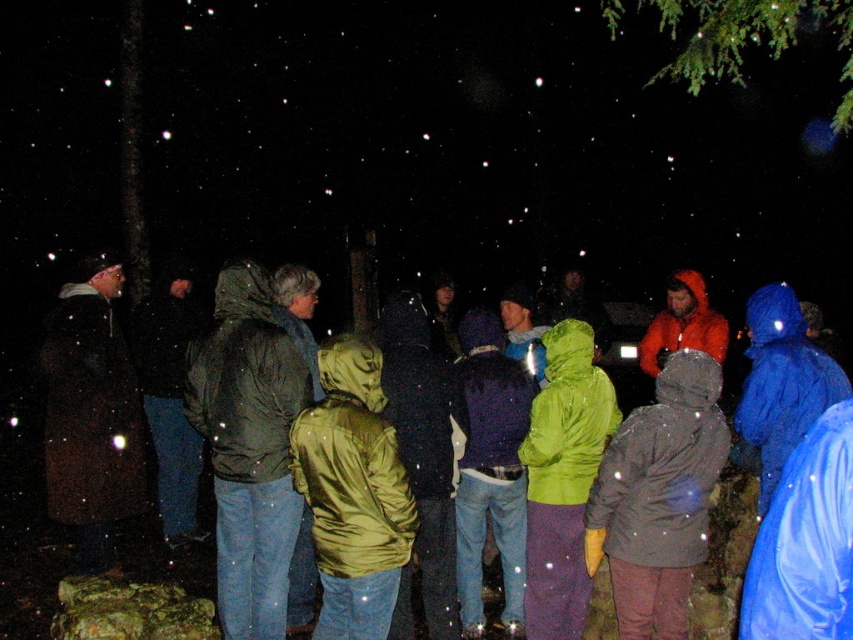
Does point (73, 326) lie in front of point (721, 54)?

That is False.

Is dark brown jacket at left thinner than green leafy branch at upper right?

Yes.

The height and width of the screenshot is (640, 853). I want to click on dark brown jacket at left, so click(x=91, y=413).

Locate an element on the screen. The height and width of the screenshot is (640, 853). dark brown jacket at left is located at coordinates (91, 413).

Which is in front, point (328, 568) or point (108, 419)?

Point (328, 568) is more forward.

Describe the element at coordinates (352, 486) in the screenshot. I see `shiny green jacket at center` at that location.

Locate an element on the screen. The width and height of the screenshot is (853, 640). shiny green jacket at center is located at coordinates (352, 486).

From the picture: Can you confirm if green leafy branch at upper right is shorter than orange waterproof jacket at center?

In fact, green leafy branch at upper right may be taller than orange waterproof jacket at center.

Is green leafy branch at upper right taller than orange waterproof jacket at center?

Yes, green leafy branch at upper right is taller than orange waterproof jacket at center.

Find the location of a particular element. The height and width of the screenshot is (640, 853). green leafy branch at upper right is located at coordinates (750, 36).